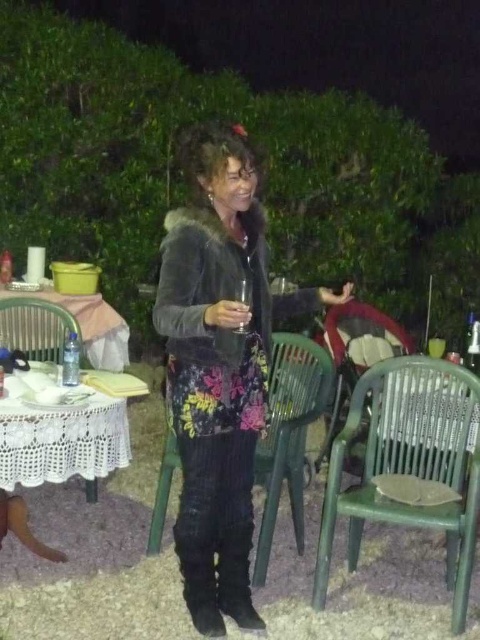
Question: Among these points, which one is nearest to the camera?

Choices:
 (A) (300, 499)
 (B) (248, 408)

Answer: (B)

Question: Is fuzzy gray jacket at center wider than white lace tablecloth at lower left?

Choices:
 (A) yes
 (B) no

Answer: (A)

Question: Is green plastic chair at lower right behind white lace table at left?

Choices:
 (A) no
 (B) yes

Answer: (A)

Question: Where is green plastic chair at center located in relation to white lace table at left in the image?

Choices:
 (A) below
 (B) above

Answer: (A)

Question: Which object appears farthest from the camera in this image?

Choices:
 (A) fuzzy gray jacket at center
 (B) white lace table at left
 (C) white lace tablecloth at lower left
 (D) green plastic chair at lower right

Answer: (B)

Question: Which object appears closest to the camera in this image?

Choices:
 (A) green plastic chair at lower right
 (B) white lace tablecloth at lower left

Answer: (B)